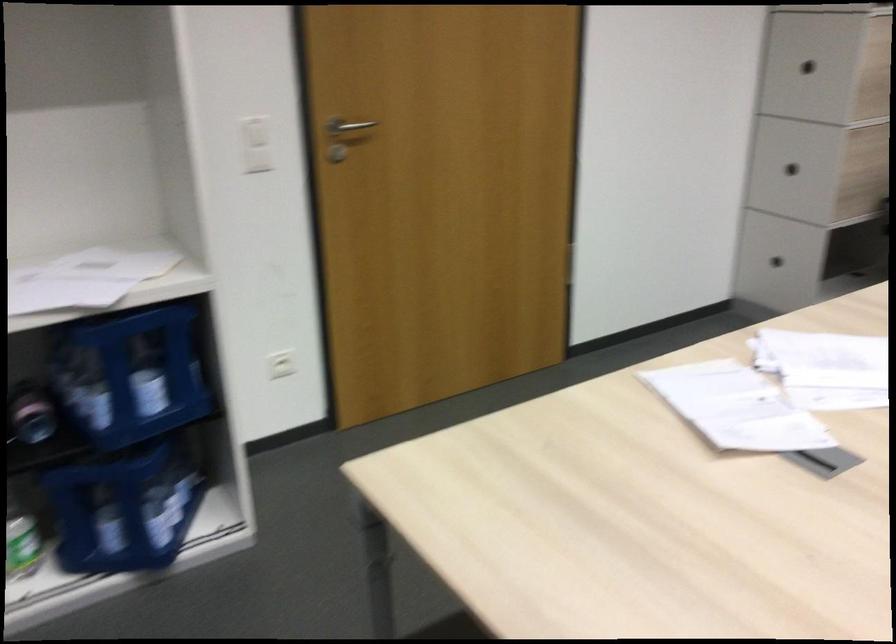
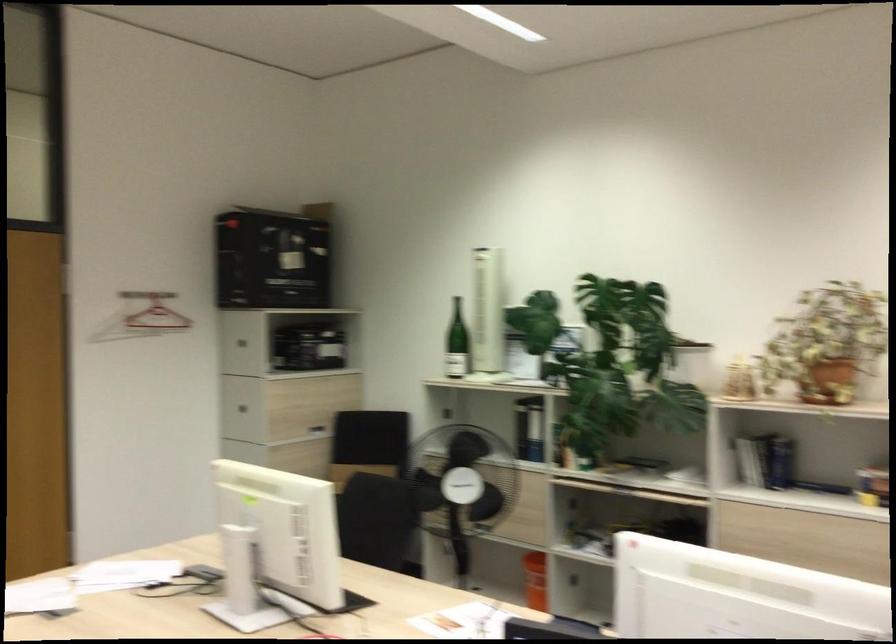
Locate, in the second image, the point that corresponds to (814,70) in the first image.

(244, 402)